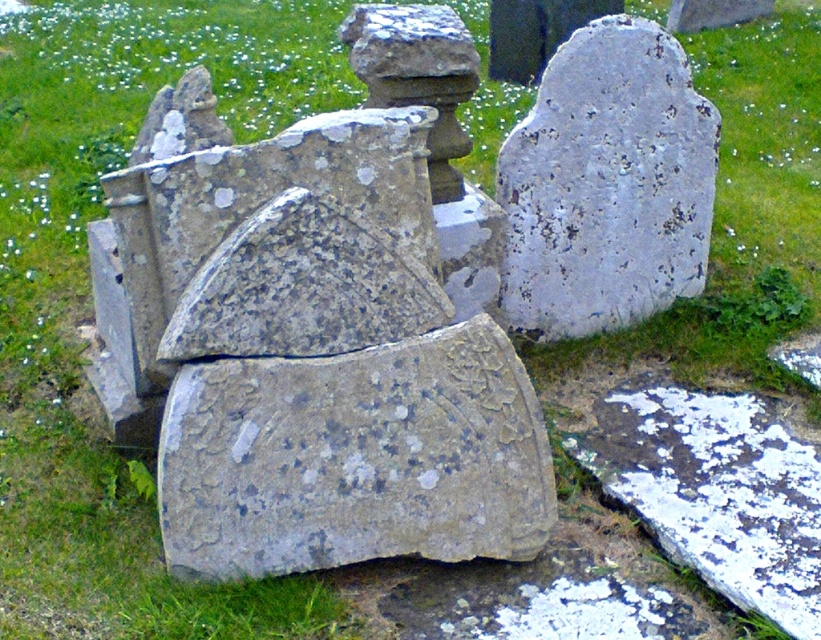
Question: Which point is closer to the camera?

Choices:
 (A) white stone at center
 (B) white speckled stone at lower right

Answer: (B)

Question: Which object is farther from the camera taking this photo?

Choices:
 (A) white speckled stone at lower right
 (B) white stone at center

Answer: (B)

Question: Can you confirm if white stone at center is wider than white speckled stone at lower right?

Choices:
 (A) no
 (B) yes

Answer: (B)

Question: Does white stone at center have a greater width compared to white speckled stone at lower right?

Choices:
 (A) no
 (B) yes

Answer: (B)

Question: Among these points, which one is nearest to the camera?

Choices:
 (A) (647, 486)
 (B) (557, 64)

Answer: (A)

Question: Can you confirm if white stone at center is positioned above white speckled stone at lower right?

Choices:
 (A) no
 (B) yes

Answer: (B)